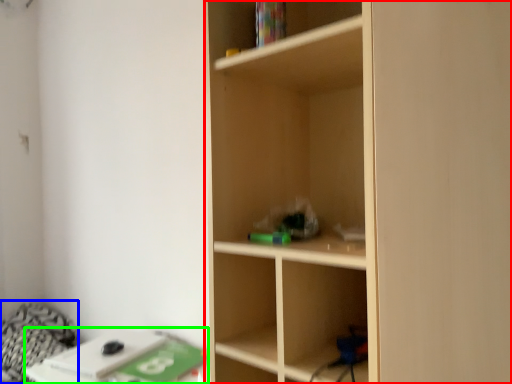
Question: Considering the real-world distances, which object is farthest from shelf (highlighted by a red box)? bedding (highlighted by a blue box) or table (highlighted by a green box)?

Choices:
 (A) bedding
 (B) table

Answer: (A)